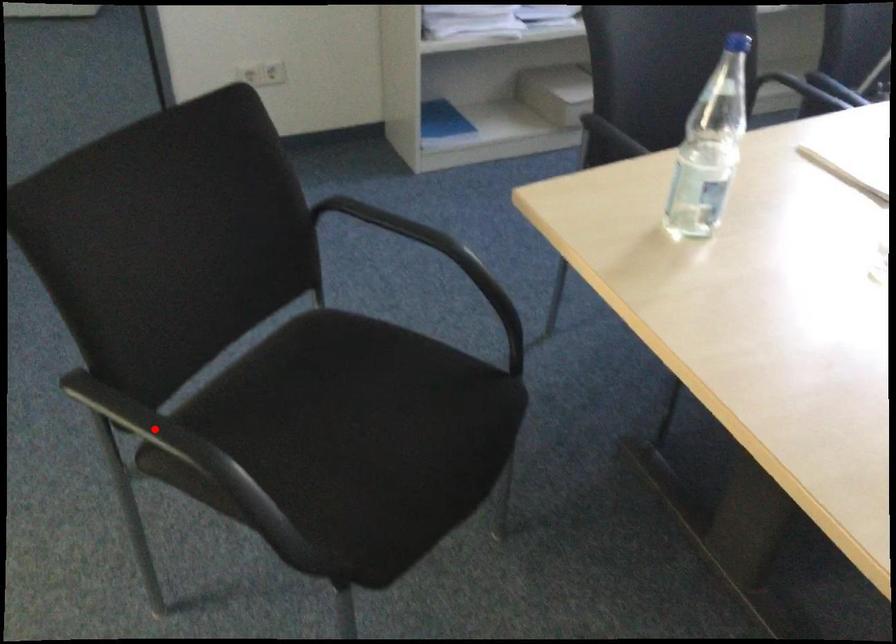
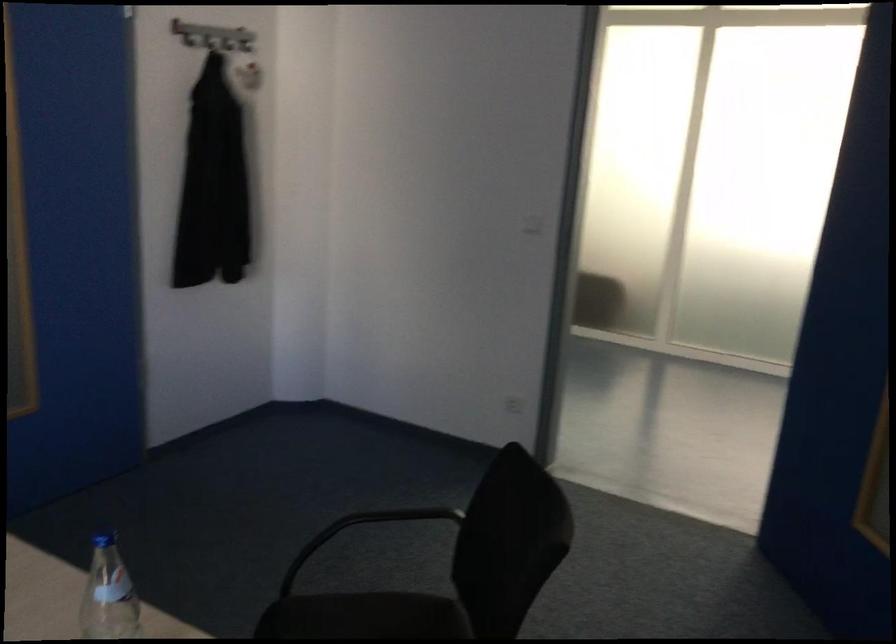
Question: I am providing you with two images of the same scene from different viewpoints. A red point is marked on the first image. At the location where the point appears in image 1, is it still visible in image 2?

Choices:
 (A) Yes
 (B) No

Answer: (B)